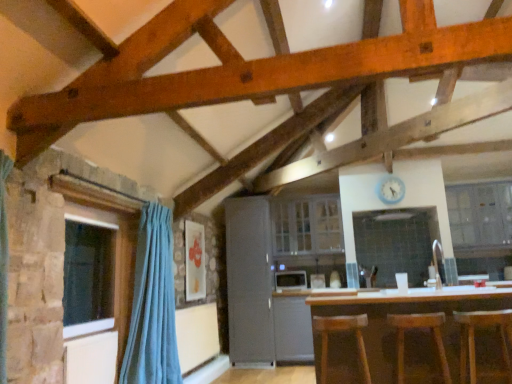
Question: Which direction should I rotate to face white glossy cabinet at upper center, marked as the 1th cabinetry in a right-to-left arrangement, — up or down?

Choices:
 (A) down
 (B) up

Answer: (A)

Question: Does white glossy cabinet at upper center, marked as the 1th cabinetry in a right-to-left arrangement, have a greater height compared to wooden bar stool at lower right, arranged as the 2th bar stool when viewed from the right?

Choices:
 (A) yes
 (B) no

Answer: (A)

Question: Is white glossy cabinet at upper center, the 2th cabinetry in the left-to-right sequence, closer to camera compared to wooden bar stool at lower right, arranged as the 2th bar stool when viewed from the right?

Choices:
 (A) yes
 (B) no

Answer: (B)

Question: Is white glossy cabinet at upper center, the 2th cabinetry in the left-to-right sequence, further to the viewer compared to wooden bar stool at lower right, the 2th bar stool when ordered from left to right?

Choices:
 (A) no
 (B) yes

Answer: (B)

Question: From the image's perspective, is white glossy cabinet at upper center, marked as the 1th cabinetry in a right-to-left arrangement, over wooden bar stool at lower right, arranged as the 2th bar stool when viewed from the right?

Choices:
 (A) yes
 (B) no

Answer: (A)

Question: Does white glossy cabinet at upper center, marked as the 1th cabinetry in a right-to-left arrangement, contain wooden bar stool at lower right, arranged as the 2th bar stool when viewed from the right?

Choices:
 (A) no
 (B) yes

Answer: (A)

Question: Does white glossy cabinet at upper center, the 2th cabinetry in the left-to-right sequence, have a larger size compared to wooden bar stool at lower right, the 2th bar stool when ordered from left to right?

Choices:
 (A) no
 (B) yes

Answer: (B)

Question: Is brown wooden table at center at the left side of wooden bar stool at lower right, the 2th bar stool when ordered from left to right?

Choices:
 (A) yes
 (B) no

Answer: (B)

Question: Is brown wooden table at center positioned with its back to wooden bar stool at lower right, arranged as the 2th bar stool when viewed from the right?

Choices:
 (A) yes
 (B) no

Answer: (A)

Question: Considering the relative positions of brown wooden table at center and wooden bar stool at lower right, arranged as the 2th bar stool when viewed from the right, in the image provided, is brown wooden table at center behind wooden bar stool at lower right, arranged as the 2th bar stool when viewed from the right,?

Choices:
 (A) yes
 (B) no

Answer: (A)

Question: Considering the relative sizes of brown wooden table at center and wooden bar stool at lower right, arranged as the 2th bar stool when viewed from the right, in the image provided, is brown wooden table at center shorter than wooden bar stool at lower right, arranged as the 2th bar stool when viewed from the right,?

Choices:
 (A) no
 (B) yes

Answer: (A)

Question: Can you confirm if brown wooden table at center is smaller than wooden bar stool at lower right, the 2th bar stool when ordered from left to right?

Choices:
 (A) yes
 (B) no

Answer: (B)

Question: Is brown wooden table at center located outside wooden bar stool at lower right, the 2th bar stool when ordered from left to right?

Choices:
 (A) no
 (B) yes

Answer: (B)

Question: Does wooden bar stool at center, placed as the 1th bar stool when sorted from left to right, come behind white glossy cabinet at upper center, marked as the 1th cabinetry in a right-to-left arrangement?

Choices:
 (A) no
 (B) yes

Answer: (A)